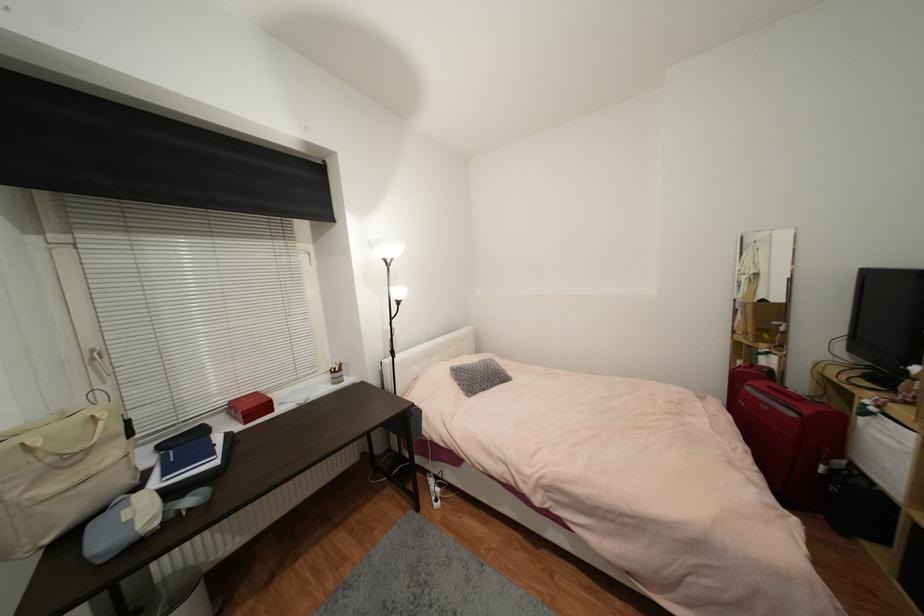
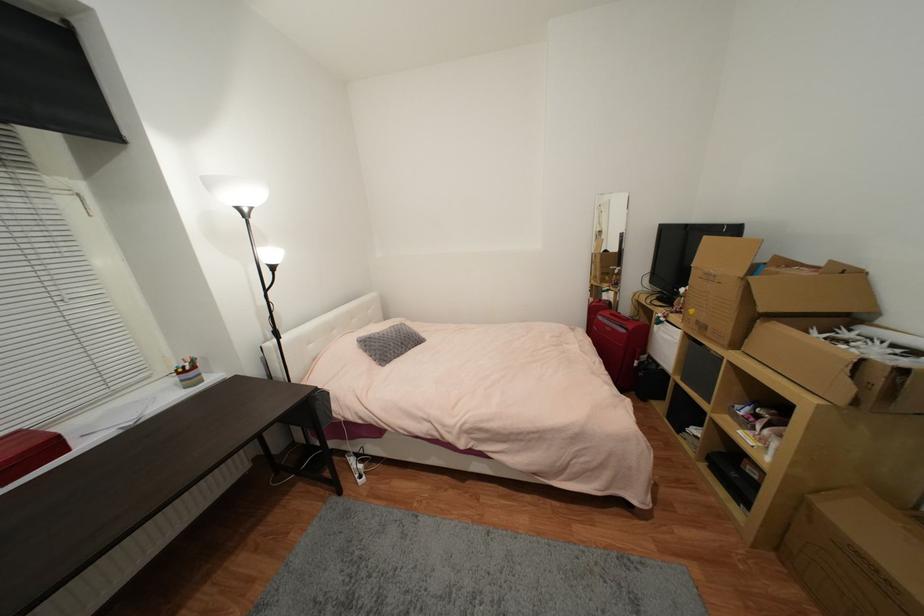
Question: The images are taken continuously from a first-person perspective. In which direction are you moving?

Choices:
 (A) Left
 (B) Right
 (C) Forward
 (D) Backward

Answer: (C)